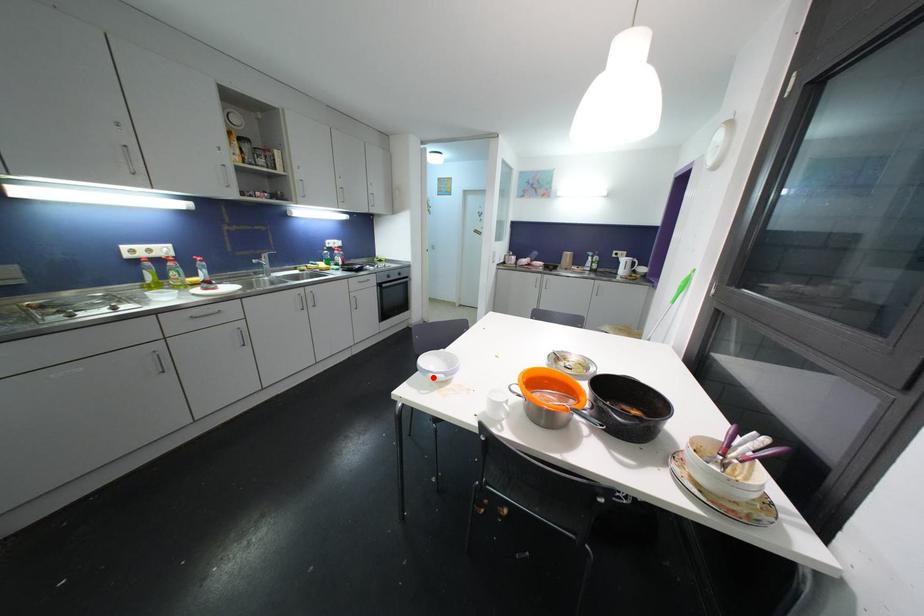
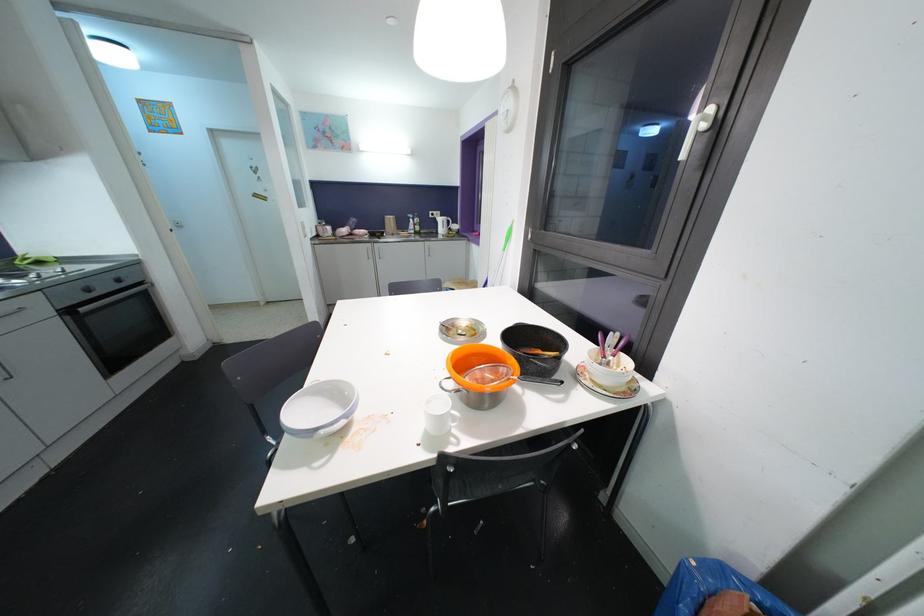
Locate, in the second image, the point that corresponds to the highlighted location in the first image.

(323, 435)